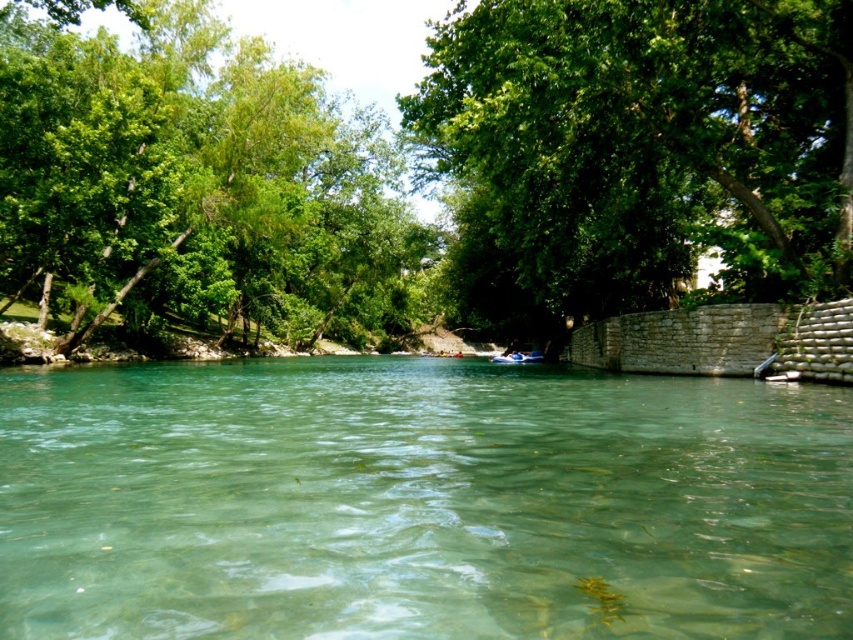
Question: Which point is closer to the camera?

Choices:
 (A) blue rubber boat at center
 (B) green leafy tree at left
 (C) clear water at center

Answer: (C)

Question: Can you confirm if clear water at center is positioned below green leafy tree at center?

Choices:
 (A) yes
 (B) no

Answer: (A)

Question: Which object is closer to the camera taking this photo?

Choices:
 (A) green leafy tree at center
 (B) clear water at center
 (C) green leafy tree at left
 (D) blue rubber boat at center

Answer: (B)

Question: Is green leafy tree at left closer to the viewer compared to blue rubber boat at center?

Choices:
 (A) no
 (B) yes

Answer: (B)

Question: Does green leafy tree at center lie in front of blue rubber boat at center?

Choices:
 (A) yes
 (B) no

Answer: (A)

Question: Which point appears farthest from the camera in this image?

Choices:
 (A) pyautogui.click(x=633, y=560)
 (B) pyautogui.click(x=656, y=170)
 (C) pyautogui.click(x=94, y=131)
 (D) pyautogui.click(x=512, y=352)

Answer: (D)